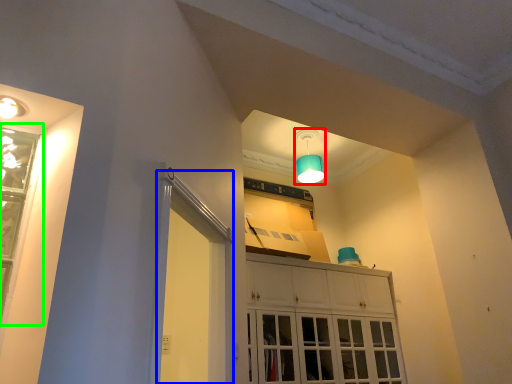
Question: Which is nearer to the lamp (highlighted by a red box)? screen door (highlighted by a blue box) or window (highlighted by a green box).

Choices:
 (A) screen door
 (B) window

Answer: (A)